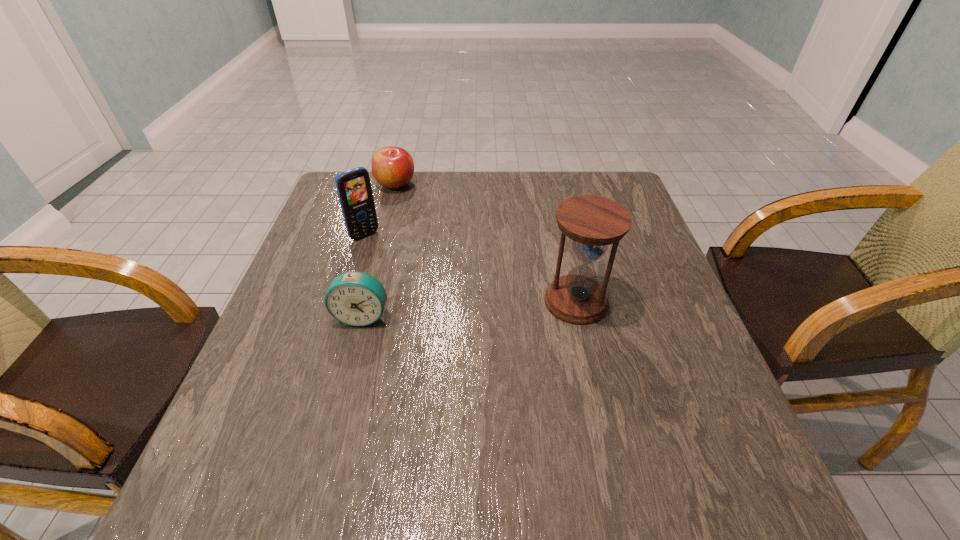
Identify the location of empty space that is in between the cellular telephone and the farthest object. The height and width of the screenshot is (540, 960). (380, 210).

Locate an element on the screen. Image resolution: width=960 pixels, height=540 pixels. free space between the third nearest object and the hourglass is located at coordinates (470, 268).

The height and width of the screenshot is (540, 960). Find the location of `empty space that is in between the rightmost object and the alarm clock`. empty space that is in between the rightmost object and the alarm clock is located at coordinates (469, 309).

Identify the location of the closest object relative to the alarm clock. The height and width of the screenshot is (540, 960). (354, 189).

Identify the location of object identified as the second closest to the apple. (354, 298).